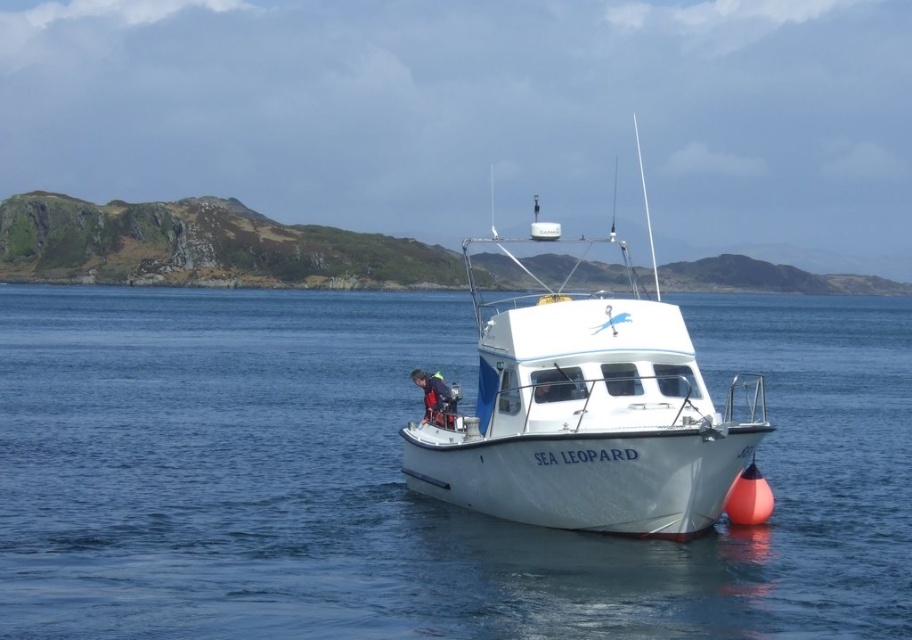
Which is in front, point (551, 422) or point (439, 392)?

Point (551, 422) is more forward.

Consider the image. Who is positioned more to the left, white glossy boat at center or blue fabric life jacket at center?

blue fabric life jacket at center is more to the left.

Between point (491, 305) and point (411, 371), which one is positioned in front?

Point (491, 305)

This screenshot has width=912, height=640. Identify the location of white glossy boat at center. (592, 417).

In the scene shown: Between clear blue water at center and white glossy boat at center, which one has less height?

With less height is clear blue water at center.

Based on the photo, does clear blue water at center have a greater width compared to white glossy boat at center?

Yes.

What do you see at coordinates (403, 476) in the screenshot? I see `clear blue water at center` at bounding box center [403, 476].

You are a GUI agent. You are given a task and a screenshot of the screen. Output one action in this format:
    pyautogui.click(x=<x>, y=<y>)
    Task: Click on the clear blue water at center
    The width and height of the screenshot is (912, 640).
    Given the screenshot: What is the action you would take?
    pyautogui.click(x=403, y=476)

Is the position of clear blue water at center less distant than that of blue fabric life jacket at center?

Yes.

Based on the photo, can you confirm if clear blue water at center is bigger than blue fabric life jacket at center?

Indeed, clear blue water at center has a larger size compared to blue fabric life jacket at center.

Who is more forward, (x=251, y=433) or (x=423, y=381)?

Point (x=423, y=381)

Locate an element on the screen. The width and height of the screenshot is (912, 640). clear blue water at center is located at coordinates (403, 476).